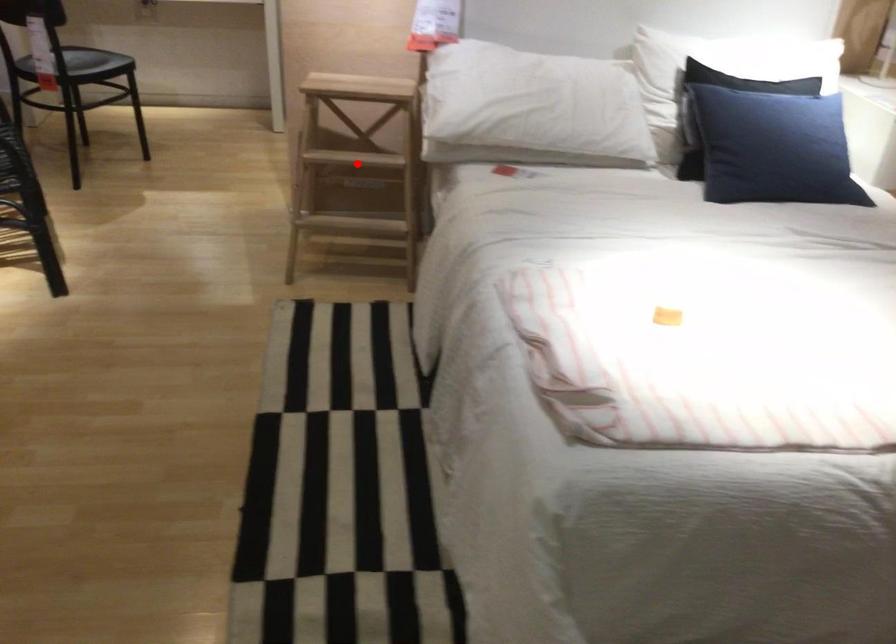
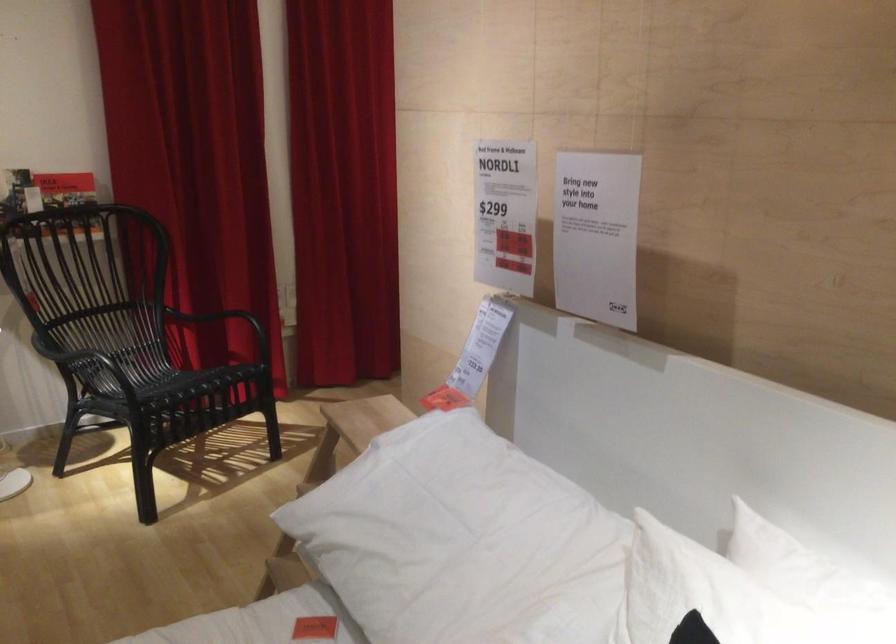
Question: I am providing you with two images of the same scene from different viewpoints. A red point is marked on the first image. At the location where the point appears in image 1, is it still visible in image 2?

Choices:
 (A) Yes
 (B) No

Answer: (B)